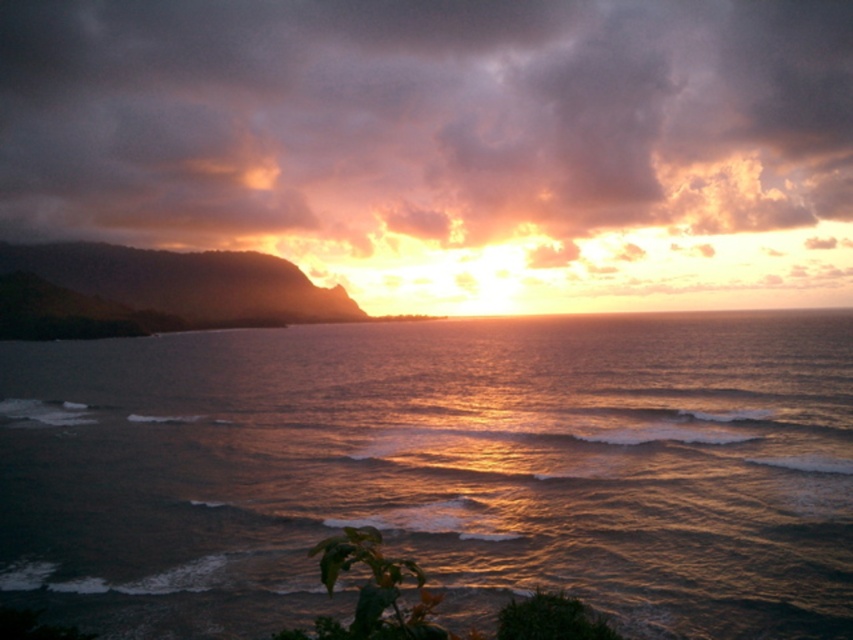
Between shiny golden water at center and cloudy sky at upper center, which one has more height?

cloudy sky at upper center is taller.

Which of these two, shiny golden water at center or cloudy sky at upper center, stands shorter?

shiny golden water at center

The width and height of the screenshot is (853, 640). Describe the element at coordinates (438, 470) in the screenshot. I see `shiny golden water at center` at that location.

This screenshot has height=640, width=853. What are the coordinates of `shiny golden water at center` in the screenshot? It's located at (438, 470).